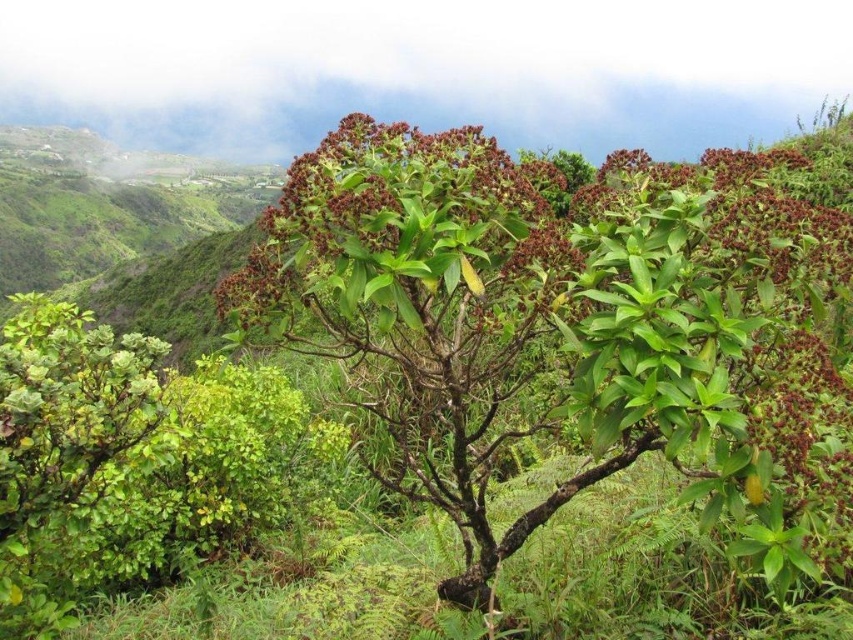
Question: In this image, where is green leafy shrub at center located relative to brown matte flower at center?

Choices:
 (A) right
 (B) left

Answer: (B)

Question: Can you confirm if green leafy shrub at center is positioned to the right of brown matte flower at center?

Choices:
 (A) no
 (B) yes

Answer: (A)

Question: Does green leafy shrub at center appear on the right side of brown matte flower at center?

Choices:
 (A) no
 (B) yes

Answer: (A)

Question: Which point is farther to the camera?

Choices:
 (A) (787, 188)
 (B) (416, 417)

Answer: (B)